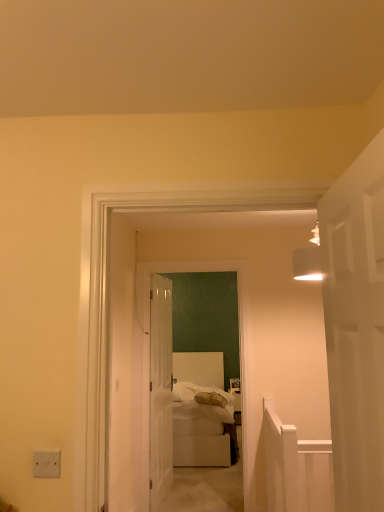
Question: Should I look upward or downward to see white soft bed at center?

Choices:
 (A) down
 (B) up

Answer: (A)

Question: Does clear glass door at center, which ranks as the 1th door in left-to-right order, turn towards white matte door at right, the second door from the left?

Choices:
 (A) yes
 (B) no

Answer: (B)

Question: Is clear glass door at center, marked as the 2th door in a right-to-left arrangement, closer to the viewer compared to white matte door at right, the first door from the front?

Choices:
 (A) yes
 (B) no

Answer: (B)

Question: Does clear glass door at center, which is the first door in back-to-front order, have a greater height compared to white matte door at right, the second door from the left?

Choices:
 (A) yes
 (B) no

Answer: (A)

Question: Is clear glass door at center, acting as the 2th door starting from the front, not inside white matte door at right, the first door from the front?

Choices:
 (A) no
 (B) yes

Answer: (B)

Question: Can you confirm if clear glass door at center, acting as the 2th door starting from the front, is bigger than white matte door at right, the first door from the front?

Choices:
 (A) yes
 (B) no

Answer: (A)

Question: From a real-world perspective, is clear glass door at center, which is the first door in back-to-front order, below white matte door at right, the second door from the left?

Choices:
 (A) yes
 (B) no

Answer: (A)

Question: Does white matte door at right, the second door when ordered from back to front, have a greater width compared to white soft bed at center?

Choices:
 (A) yes
 (B) no

Answer: (B)

Question: Is white matte door at right, the second door when ordered from back to front, shorter than white soft bed at center?

Choices:
 (A) yes
 (B) no

Answer: (A)

Question: From a real-world perspective, is white matte door at right, the first door from the front, under white soft bed at center?

Choices:
 (A) yes
 (B) no

Answer: (B)

Question: Does white matte door at right, the second door when ordered from back to front, have a greater height compared to white soft bed at center?

Choices:
 (A) yes
 (B) no

Answer: (B)

Question: Is white matte door at right, the second door when ordered from back to front, not near white soft bed at center?

Choices:
 (A) no
 (B) yes

Answer: (B)

Question: Is white soft bed at center inside white matte door at right, the second door from the left?

Choices:
 (A) yes
 (B) no

Answer: (B)

Question: Is white plastic/light switch at lower left not close to white soft bed at center?

Choices:
 (A) yes
 (B) no

Answer: (A)